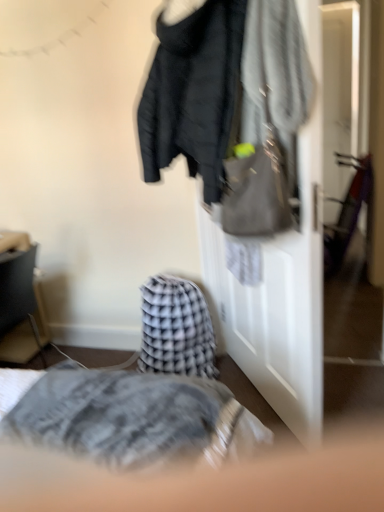
The image size is (384, 512). In order to click on vacant space underneath matte black jacket at center (from a real-world perspective) in this screenshot , I will do `click(266, 413)`.